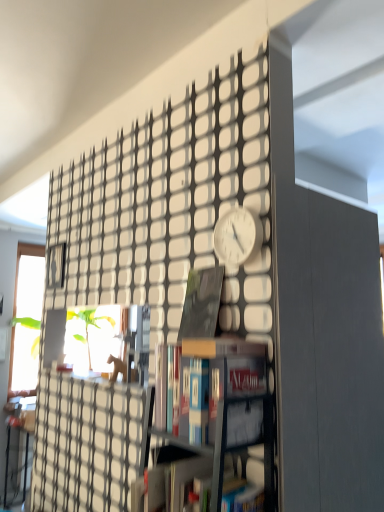
Question: From their relative heights in the image, would you say hardcover book at center, the 3th book in the top-to-bottom sequence, is taller or shorter than matte black book at center, marked as the 1th book in a top-to-bottom arrangement?

Choices:
 (A) short
 (B) tall

Answer: (A)

Question: Does point (132, 502) appear closer or farther from the camera than point (198, 312)?

Choices:
 (A) closer
 (B) farther

Answer: (A)

Question: Considering the real-world distances, which object is closest to the hardcover book at center, the 2th book positioned from the top?

Choices:
 (A) matte black book at center, marked as the 1th book in a top-to-bottom arrangement
 (B) hardcover book at center, the 3th book in the top-to-bottom sequence
 (C) white matte clock at center

Answer: (B)

Question: Which object is the farthest from the hardcover book at center, the 2th book positioned from the top?

Choices:
 (A) white matte clock at center
 (B) hardcover book at center, the 3th book in the top-to-bottom sequence
 (C) matte black book at center, marked as the 1th book in a top-to-bottom arrangement

Answer: (A)